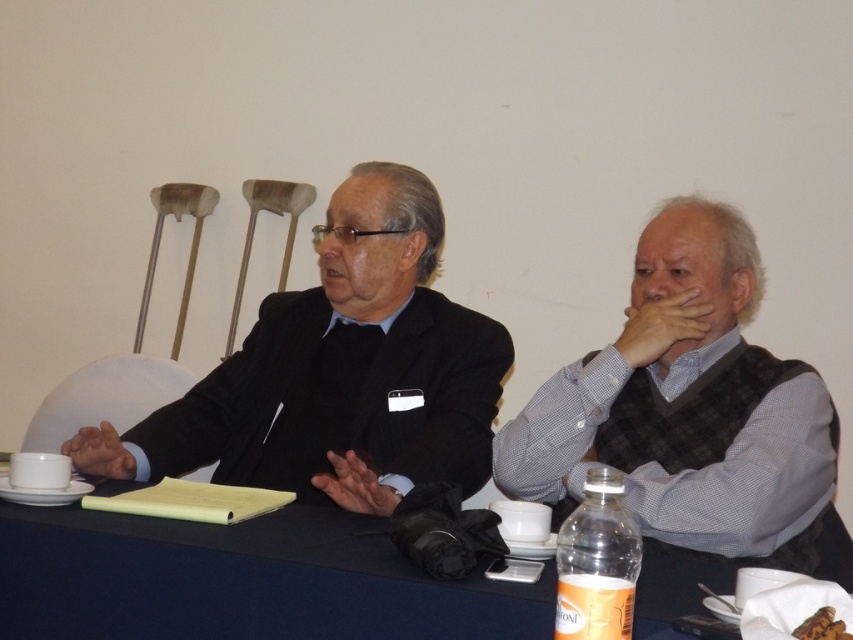
You are standing in front of the table where the two individuals are seated. You need to place a small object exactly at the center of the table. The table has a coordinate system where the bottom left corner is the origin point. The coordinates of the matte black suit at center are given as point 0.580, 0.397. What are the coordinates where you should place the small object to be at the exact center of the table?

The coordinates for the exact center of the table would be at point (426, 320). Since the matte black suit at center is at (338, 371), you should move the object slightly to the left and upwards to reach the true center.

Consider the image. You are a server in a restaurant and need to place a new plate between the matte black suit at center and the brown crumbly bread at center. The plate has a diameter of 1 foot. Is there enough space to place the plate between them without moving either object?

The distance between the matte black suit at center and the brown crumbly bread at center is 3.93 feet. Since the plate has a diameter of 1 foot, there is sufficient space to place it between them without moving either object.

In the scene shown: You are a photographer trying to capture a candid shot of the two people at the table. To avoid obstructing the view, you need to position yourself where the blue fabric table at center is not between you and the subjects. Based on its coordinates, where should you position yourself relative to the table?

Since the blue fabric table at center is located at point (241, 580), you should position yourself either to the left or right side of the table to ensure it doesn not block your view of the subjects.